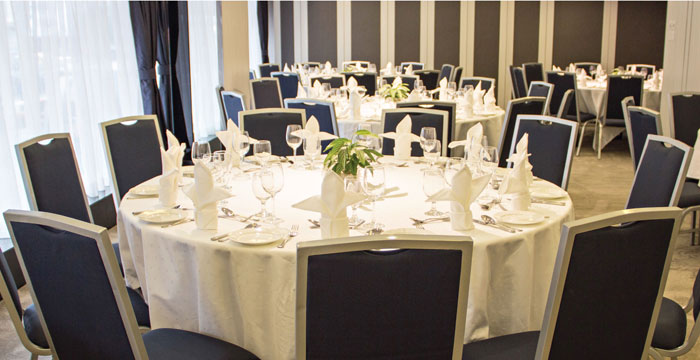
Image resolution: width=700 pixels, height=360 pixels. I want to click on tablecloths, so click(304, 215), click(368, 116), click(304, 80), click(595, 84), click(696, 140).